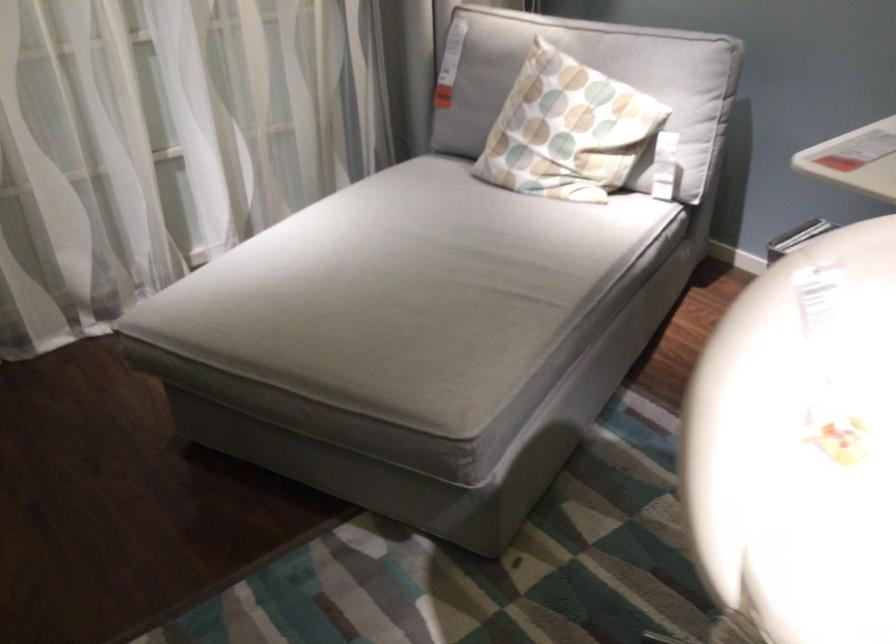
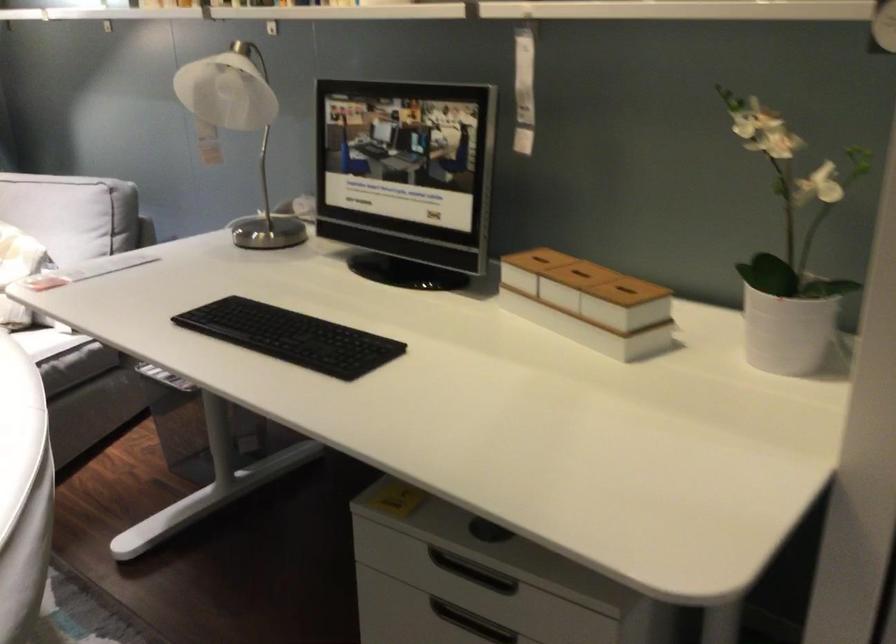
Question: The images are taken continuously from a first-person perspective. In which direction are you moving?

Choices:
 (A) Left
 (B) Right
 (C) Forward
 (D) Backward

Answer: (B)